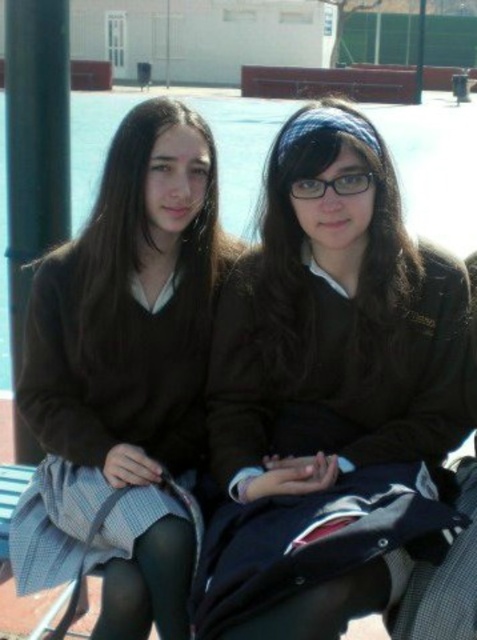
Question: Does matte brown sweater at left have a larger size compared to black metal pole at left?

Choices:
 (A) yes
 (B) no

Answer: (B)

Question: Which object is closer to the camera taking this photo?

Choices:
 (A) matte brown sweater at left
 (B) transparent plastic glasses at center
 (C) black metal pole at left

Answer: (A)

Question: Can you confirm if black metal pole at left is thinner than transparent plastic glasses at center?

Choices:
 (A) yes
 (B) no

Answer: (B)

Question: Can you confirm if matte brown sweater at left is wider than black metal pole at left?

Choices:
 (A) no
 (B) yes

Answer: (B)

Question: Which point is farther to the camera?

Choices:
 (A) matte black jacket at center
 (B) transparent plastic glasses at center
 (C) matte brown sweater at left

Answer: (B)

Question: Which point is farther from the camera taking this photo?

Choices:
 (A) (281, 378)
 (B) (298, 189)

Answer: (A)